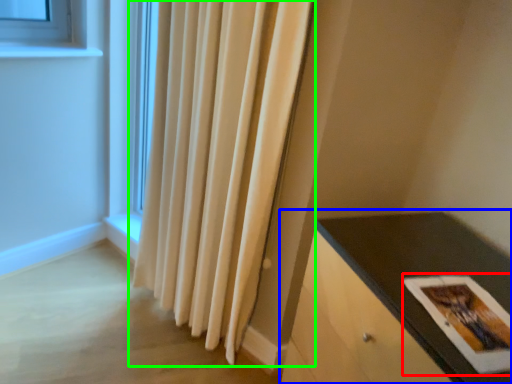
Question: Estimate the real-world distances between objects in this image. Which object is farther from postcard (highlighted by a red box), table (highlighted by a blue box) or curtain (highlighted by a green box)?

Choices:
 (A) table
 (B) curtain

Answer: (B)